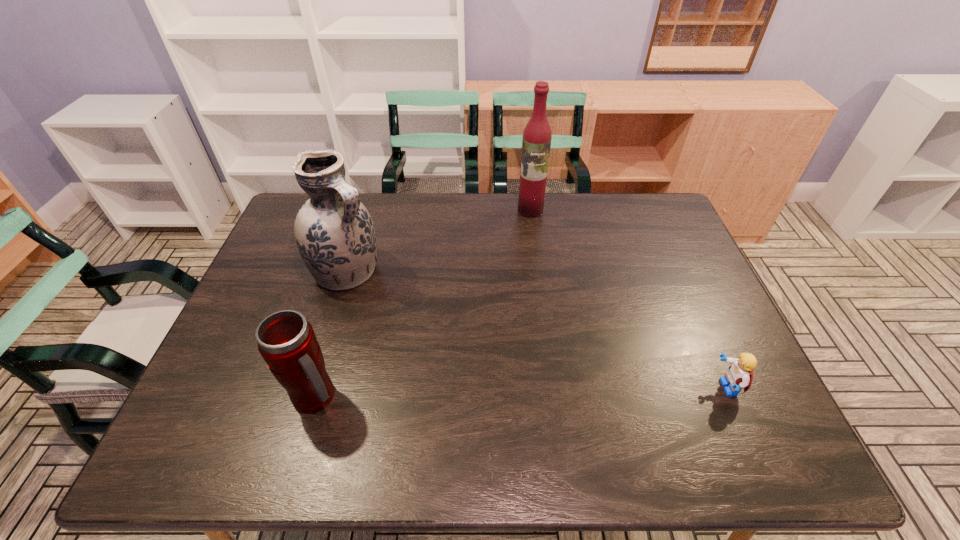
Where is `object that is at the left edge`? This screenshot has height=540, width=960. object that is at the left edge is located at coordinates (335, 235).

You are a GUI agent. You are given a task and a screenshot of the screen. Output one action in this format:
    pyautogui.click(x=<x>, y=<y>)
    Task: Click on the object positioned at the right edge
    
    Given the screenshot: What is the action you would take?
    [x=739, y=375]

The image size is (960, 540). I want to click on object that is positioned at the near right corner, so click(x=739, y=375).

Locate an element on the screen. The image size is (960, 540). vacant region at the far edge of the desktop is located at coordinates (505, 235).

In the image, there is a desktop. Where is `vacant space at the near edge`? The image size is (960, 540). vacant space at the near edge is located at coordinates (540, 384).

Where is `vacant space at the right edge of the desktop`? The image size is (960, 540). vacant space at the right edge of the desktop is located at coordinates (710, 307).

The height and width of the screenshot is (540, 960). In the image, there is a desktop. Find the location of `free space at the near left corner`. free space at the near left corner is located at coordinates (213, 414).

In the image, there is a desktop. Identify the location of vacant space at the far right corner. This screenshot has height=540, width=960. point(623,206).

Locate an element on the screen. Image resolution: width=960 pixels, height=540 pixels. free spot between the third shortest object and the second shortest object is located at coordinates (331, 334).

Where is `vacant space that is in between the farthest object and the vase`? The height and width of the screenshot is (540, 960). vacant space that is in between the farthest object and the vase is located at coordinates (439, 240).